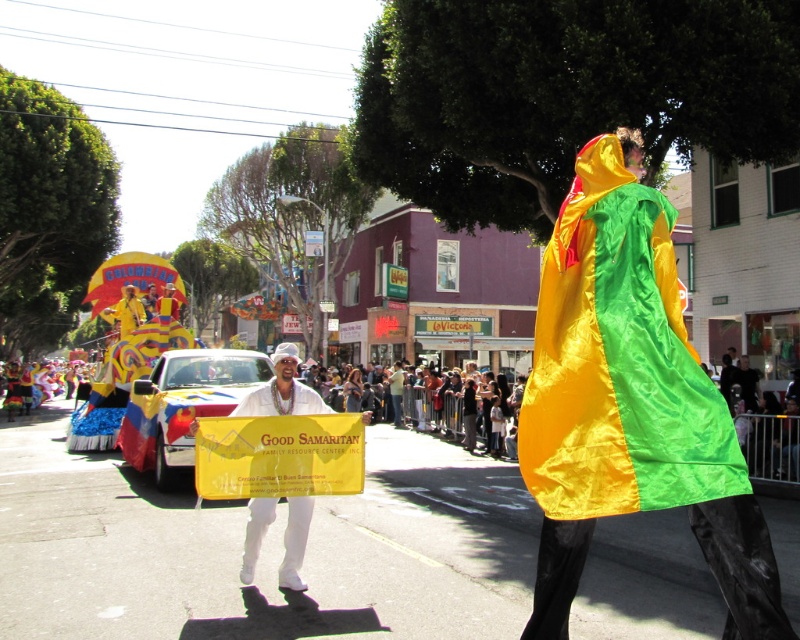
You are a photographer at the parade. You want to capture a photo where both the shiny satin cape at center and the white satin banner at center are visible. Given their sizes, which object should you focus on to ensure both fit in the frame?

The shiny satin cape at center is narrower than the white satin banner at center. To ensure both fit in the frame, focus on the shiny satin cape at center since it requires less space, allowing the wider banner to also be included.

You are a photographer trying to capture the entire parade scene. You notice two points in the image at coordinates point(618, 291) and point(300, 531). Which point is closer to your camera lens?

Point(618, 291) is closer to the viewer than point(300, 531).